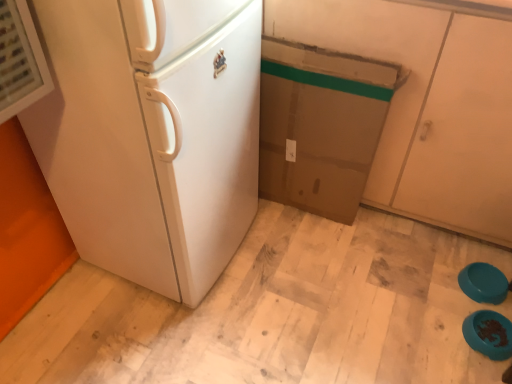
You are a GUI agent. You are given a task and a screenshot of the screen. Output one action in this format:
    pyautogui.click(x=<x>, y=<y>)
    Task: Click on the free spot to the right of white matte refrigerator at left
    
    Given the screenshot: What is the action you would take?
    pyautogui.click(x=294, y=270)